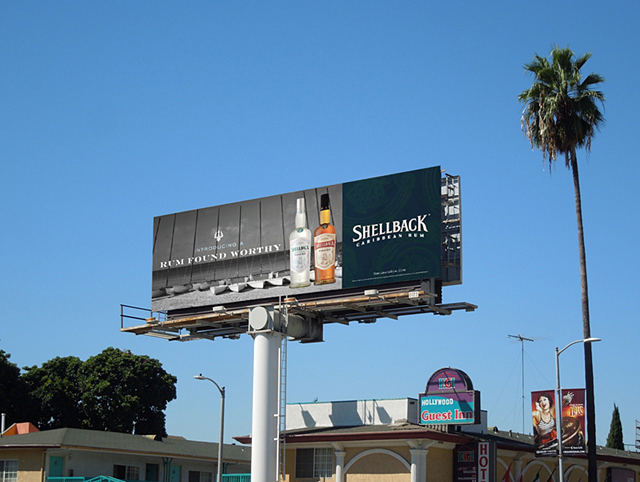
Where is `planks`? The height and width of the screenshot is (482, 640). planks is located at coordinates (194, 225).